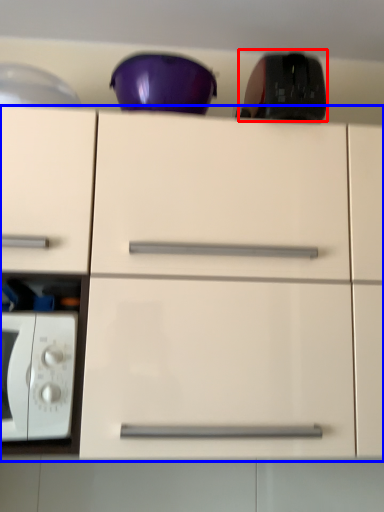
Question: Which object appears closest to the camera in this image, appliance (highlighted by a red box) or cabinetry (highlighted by a blue box)?

Choices:
 (A) appliance
 (B) cabinetry

Answer: (B)